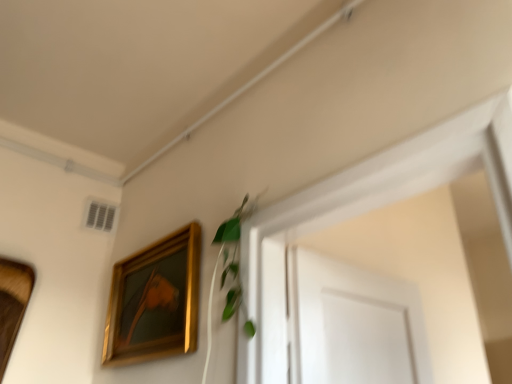
Question: Is gold/glossy picture frame at upper left, the 2th picture frame positioned from the left, spatially inside green leafy plant at upper center, or outside of it?

Choices:
 (A) inside
 (B) outside

Answer: (B)

Question: Is gold/glossy picture frame at upper left, the 1th picture frame when ordered from right to left, in front of or behind green leafy plant at upper center in the image?

Choices:
 (A) behind
 (B) front

Answer: (A)

Question: Considering the real-world distances, which object is farthest from the green leafy plant at upper center?

Choices:
 (A) gold/glossy picture frame at upper left, the 2th picture frame positioned from the left
 (B) wooden picture frame at left, arranged as the 2th picture frame when viewed from the right

Answer: (B)

Question: Which object is the farthest from the green leafy plant at upper center?

Choices:
 (A) gold/glossy picture frame at upper left, the 1th picture frame when ordered from right to left
 (B) wooden picture frame at left, the first picture frame viewed from the left

Answer: (B)